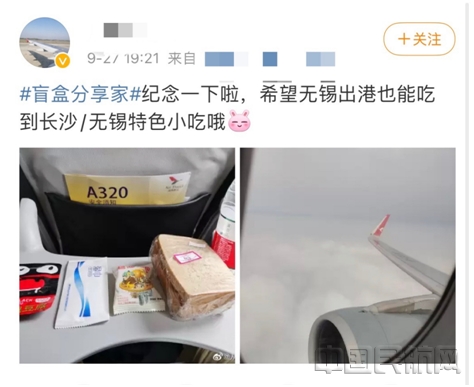
You are a GUI agent. You are given a task and a screenshot of the screen. Output one action in this format:
    pyautogui.click(x=<x>, y=<y>)
    Task: Click on the magazine
    The height and width of the screenshot is (387, 474).
    Given the screenshot: What is the action you would take?
    pyautogui.click(x=153, y=193)